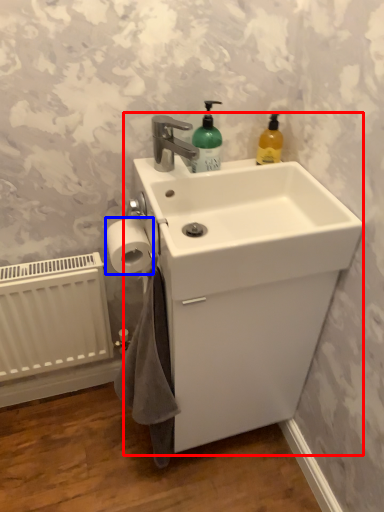
Question: Among these objects, which one is farthest to the camera, sink (highlighted by a red box) or toilet paper (highlighted by a blue box)?

Choices:
 (A) sink
 (B) toilet paper

Answer: (B)